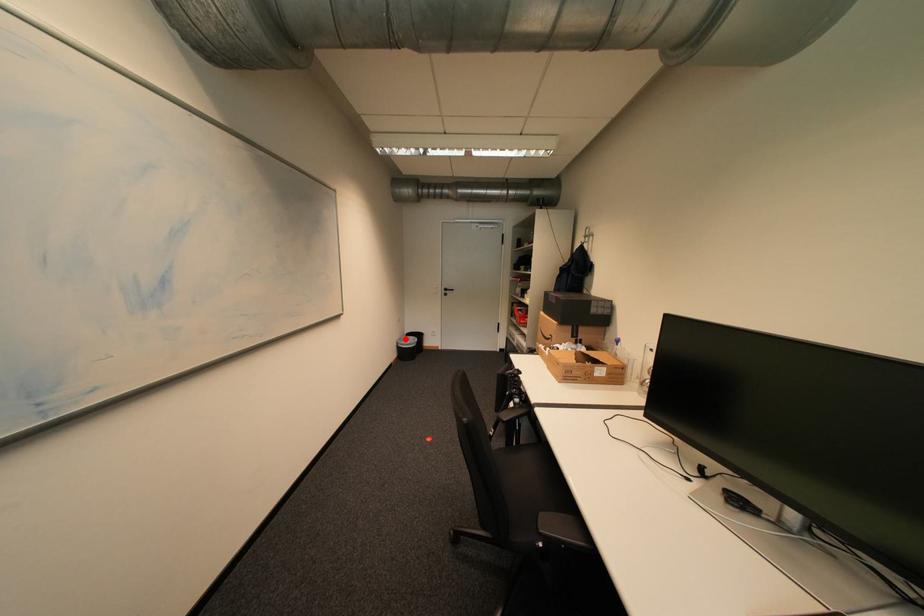
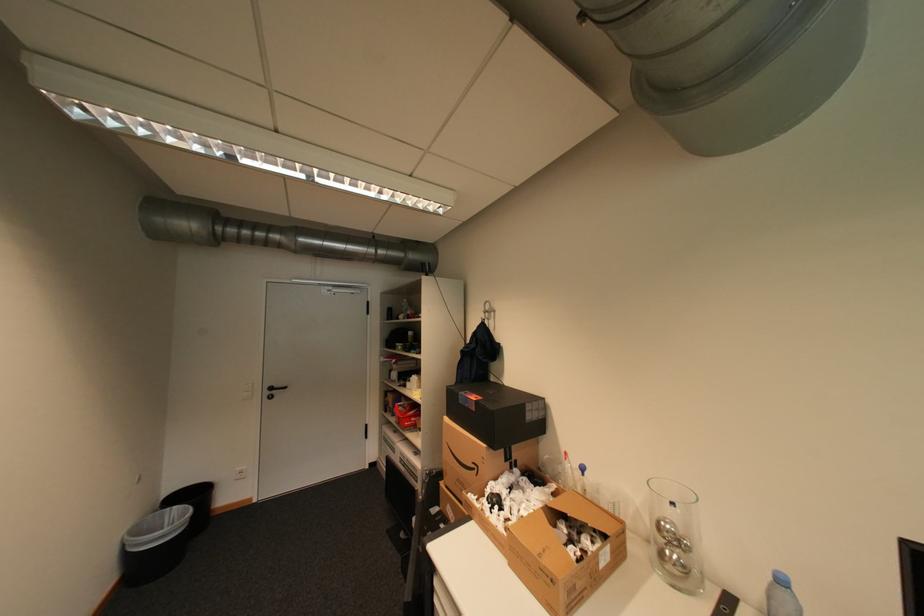
Find the pixel in the second image that matches the highlighted location in the first image.

(132, 531)